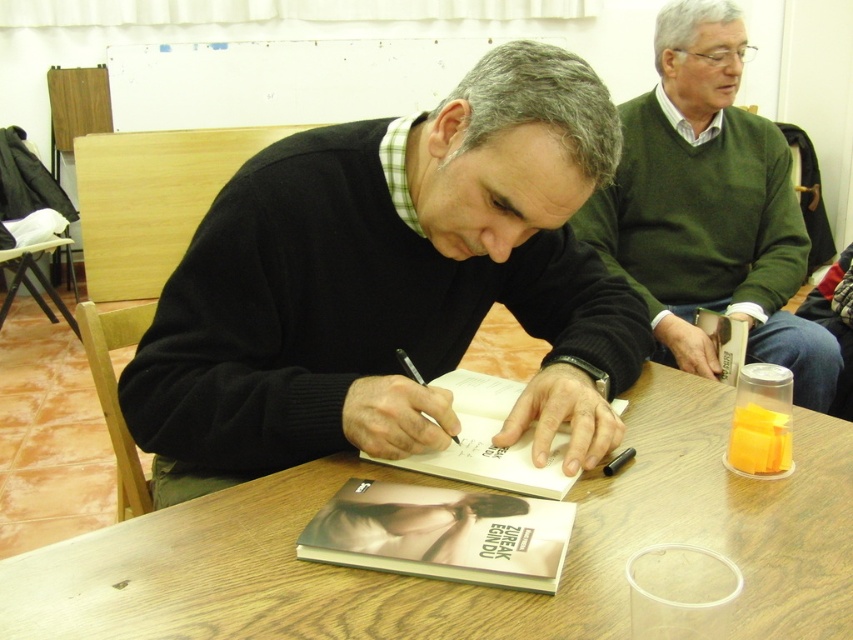
In the scene shown: What is the relationship in width between the soft matte cover at center and the black paper at center?

The soft matte cover at center is wider than the black paper at center.

What is the 2D coordinate of the green sweater at center?

The green sweater at center is located at the 2D coordinate point of [709,209].

You are an event organizer at the book signing. You need to place a small decorative item between the soft matte cover at center and the black paper at center on the table. Which object should you place the item closer to so it doesn

The soft matte cover at center is bigger than the black paper at center, so placing the decorative item closer to the black paper at center would ensure it is centered between both objects.